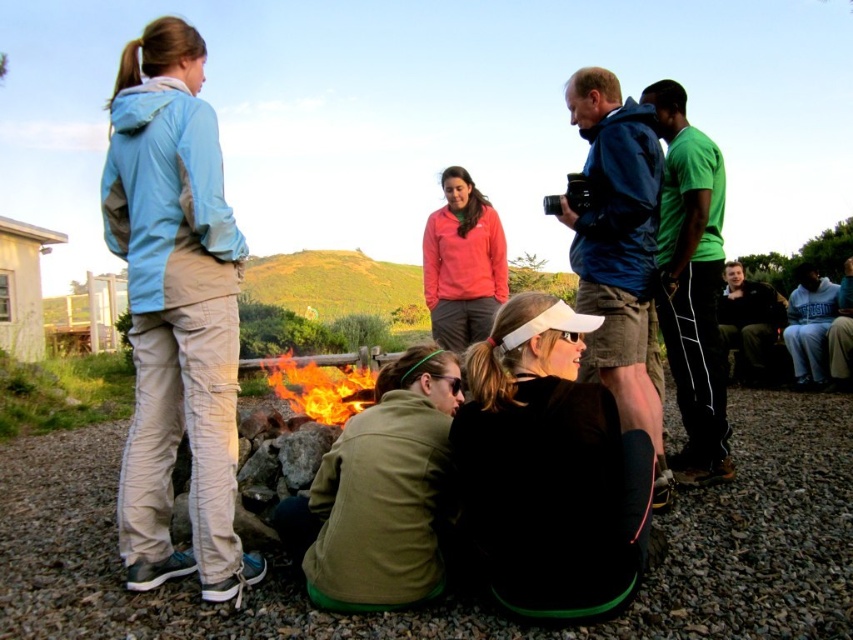
You are a photographer standing at the campfire scene. You want to position yourself so that the light blue fabric jacket at upper left is in the center of your camera viewfinder. Where should you move relative to the current camera position?

Since the light blue fabric jacket at upper left is located at point 0.487 on the x axis and 0.206 on the y axis, you should move your camera to the right and down to center it in the viewfinder.

You are a photographer trying to capture the scene of the campfire. You need to ensure that both the matte pink hoodie at center and the flaming wood at center are in focus. Given that your camera can only focus on objects within a 4 meter range, will both subjects be in focus?

The matte pink hoodie at center and the flaming wood at center are 4.35 meters apart. Since the distance between them exceeds the camera focus range of 4 meters, both subjects cannot be in focus simultaneously.